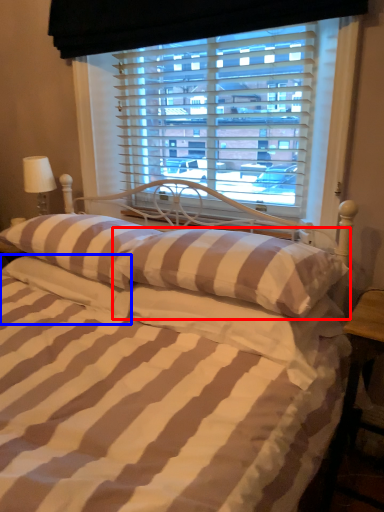
Question: Which of the following is the closest to the observer, pillow (highlighted by a red box) or pillow (highlighted by a blue box)?

Choices:
 (A) pillow
 (B) pillow

Answer: (A)